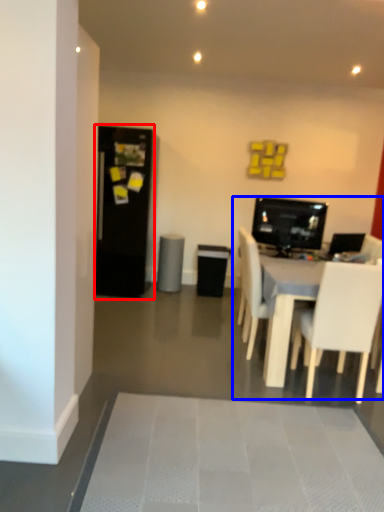
Question: Which point is further to the camera, fridge (highlighted by a red box) or entertainment center (highlighted by a blue box)?

Choices:
 (A) fridge
 (B) entertainment center

Answer: (A)